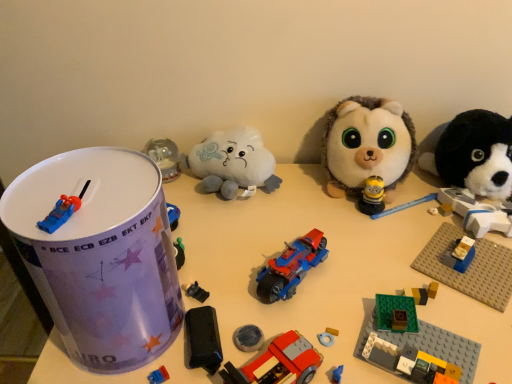
The width and height of the screenshot is (512, 384). What are the coordinates of `empty space that is in between fluffy white plush at center, the 8th toy when ordered from left to right, and black plastic toy car at center, placed as the fourth toy when sorted from left to right` in the screenshot? It's located at (296, 234).